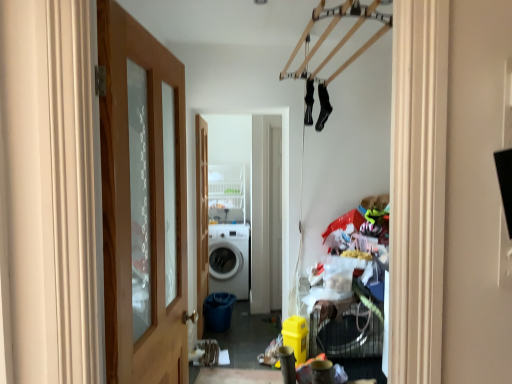
Question: Is black fabric socks at upper center, which ranks as the 1th clothing in right-to-left order, taller or shorter than white matte washing machine at center?

Choices:
 (A) short
 (B) tall

Answer: (A)

Question: In terms of width, does black fabric socks at upper center, which is counted as the 2th clothing, starting from the left, look wider or thinner when compared to white matte washing machine at center?

Choices:
 (A) wide
 (B) thin

Answer: (B)

Question: Which object is the farthest from the black fabric socks at upper center, which ranks as the 1th clothing in right-to-left order?

Choices:
 (A) white matte washing machine at center
 (B) wooden door at center, acting as the first door starting from the back
 (C) wooden door at left, which appears as the first door when viewed from the front
 (D) black fabric socks at upper center, the second clothing positioned from the right

Answer: (A)

Question: Considering the real-world distances, which object is farthest from the black fabric socks at upper center, marked as the first clothing in a left-to-right arrangement?

Choices:
 (A) wooden door at left, the first door when ordered from right to left
 (B) white matte washing machine at center
 (C) wooden door at center, arranged as the 1th door when viewed from the left
 (D) black fabric socks at upper center, which ranks as the 1th clothing in right-to-left order

Answer: (B)